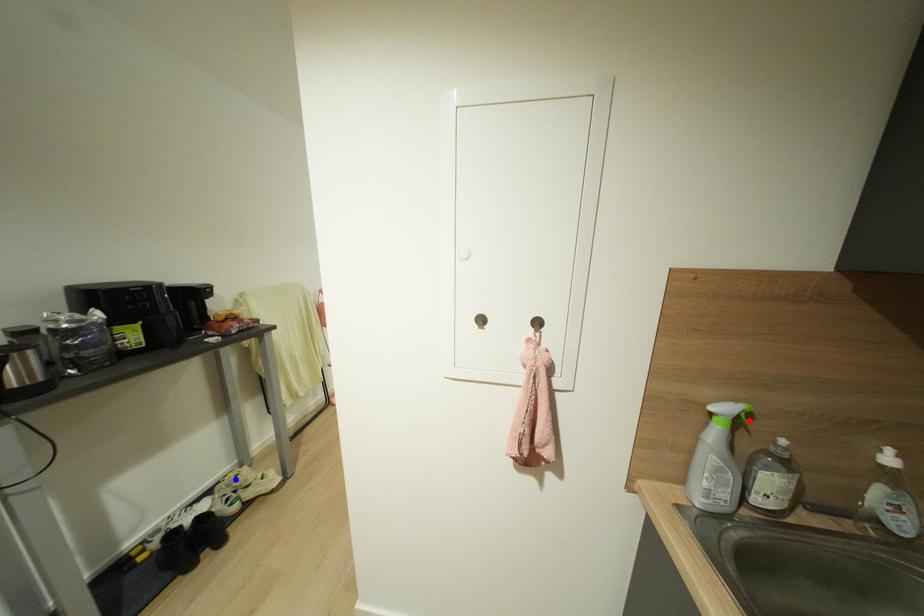
Question: In the image, two points are highlighted. Which point is nearer to the camera? Reply with the corresponding letter.

Choices:
 (A) blue point
 (B) red point

Answer: (B)